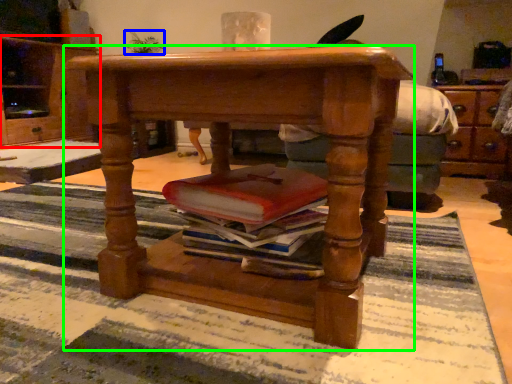
Question: Based on their relative distances, which object is nearer to cabinetry (highlighted by a red box)? Choose from houseplant (highlighted by a blue box) and desk (highlighted by a green box).

Choices:
 (A) houseplant
 (B) desk

Answer: (A)